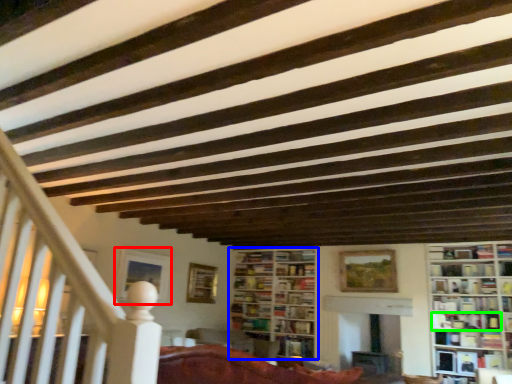
Question: Based on their relative distances, which object is farther from picture frame (highlighted by a red box)? Choose from bookcase (highlighted by a blue box) and book (highlighted by a green box).

Choices:
 (A) bookcase
 (B) book

Answer: (B)